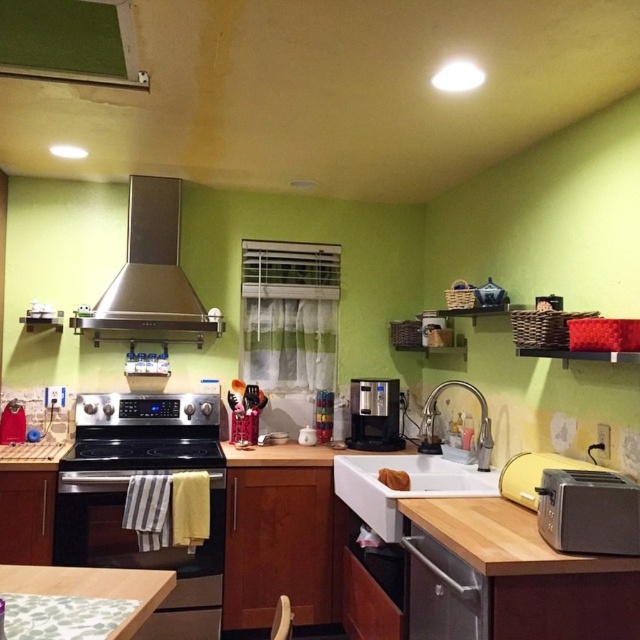
Question: Which of these objects is positioned closest to the silver metallic toaster at lower right?

Choices:
 (A) satin silver dishwasher at lower center
 (B) black stainless steel oven at lower left
 (C) wooden textured counter top at lower left
 (D) satin black coffee machine at center

Answer: (A)

Question: Which object is farther from the camera taking this photo?

Choices:
 (A) stainless steel exhaust hood at upper left
 (B) black glass stove at lower left
 (C) white matte sink at center

Answer: (A)

Question: Does black stainless steel oven at lower left come in front of white matte sink at center?

Choices:
 (A) no
 (B) yes

Answer: (A)

Question: Considering the relative positions of silver metallic toaster at lower right and wooden textured counter top at lower left in the image provided, where is silver metallic toaster at lower right located with respect to wooden textured counter top at lower left?

Choices:
 (A) right
 (B) left

Answer: (A)

Question: Is wooden textured counter top at lower left smaller than black glass stove at lower left?

Choices:
 (A) no
 (B) yes

Answer: (B)

Question: Which of the following is the farthest from the observer?

Choices:
 (A) black stainless steel oven at lower left
 (B) satin black coffee machine at center
 (C) stainless steel exhaust hood at upper left

Answer: (B)